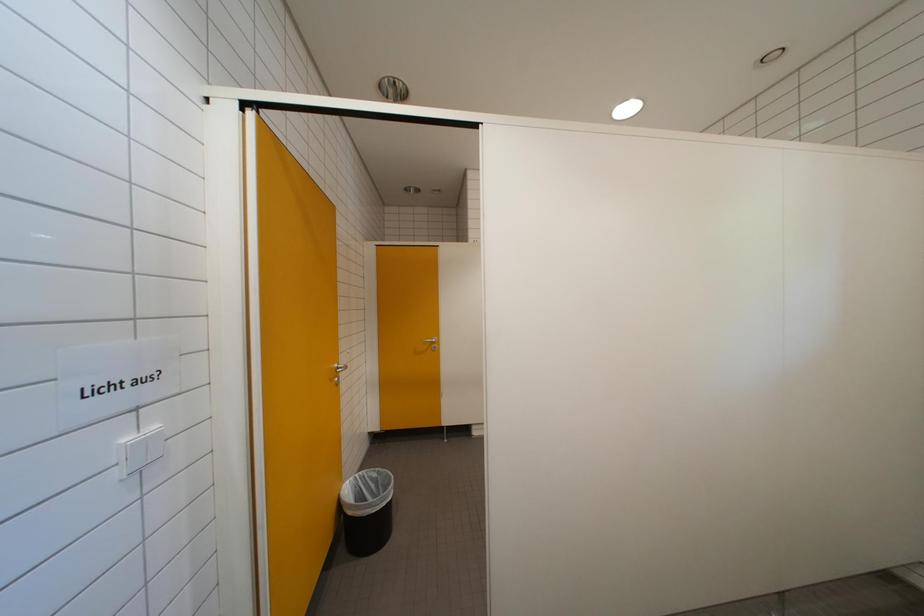
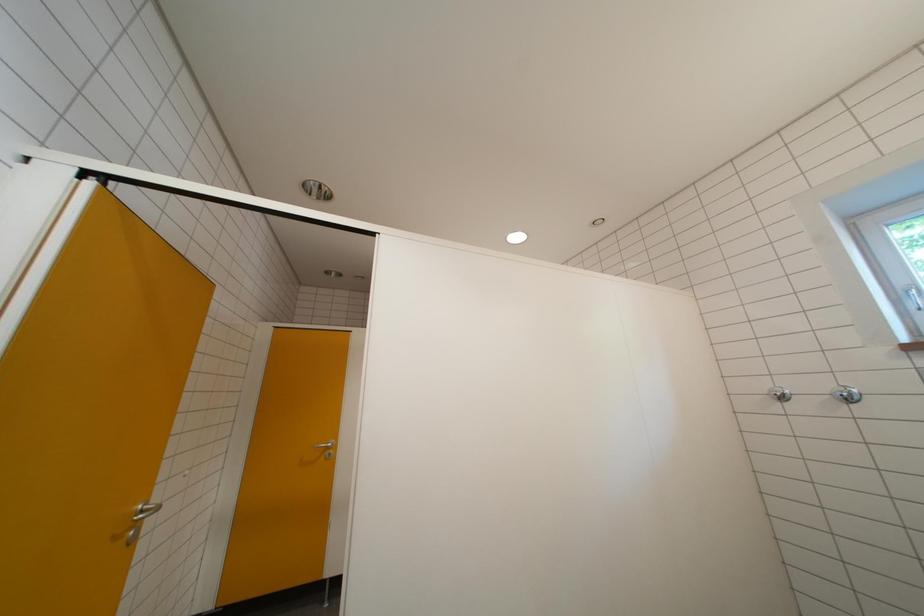
The images are taken continuously from a first-person perspective. In which direction is your viewpoint rotating?

The rotation direction of the camera is right-up.